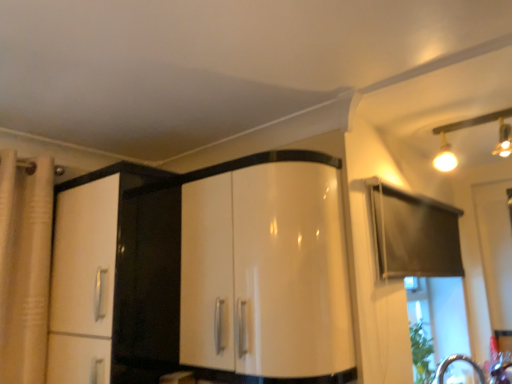
Question: Is matte gold track lights at upper right facing away from glossy white cabinet at center?

Choices:
 (A) no
 (B) yes

Answer: (A)

Question: Does matte gold track lights at upper right have a larger size compared to glossy white cabinet at center?

Choices:
 (A) no
 (B) yes

Answer: (A)

Question: From a real-world perspective, is matte gold track lights at upper right under glossy white cabinet at center?

Choices:
 (A) no
 (B) yes

Answer: (A)

Question: Does matte gold track lights at upper right touch glossy white cabinet at center?

Choices:
 (A) yes
 (B) no

Answer: (B)

Question: Is matte gold track lights at upper right smaller than glossy white cabinet at center?

Choices:
 (A) yes
 (B) no

Answer: (A)

Question: Does matte gold track lights at upper right have a lesser height compared to glossy white cabinet at center?

Choices:
 (A) no
 (B) yes

Answer: (B)

Question: Does glossy white cabinet at center have a smaller size compared to matte gold track lights at upper right?

Choices:
 (A) yes
 (B) no

Answer: (B)

Question: Is glossy white cabinet at center positioned with its back to matte gold track lights at upper right?

Choices:
 (A) no
 (B) yes

Answer: (A)

Question: Does glossy white cabinet at center have a greater width compared to matte gold track lights at upper right?

Choices:
 (A) no
 (B) yes

Answer: (A)

Question: Can you confirm if glossy white cabinet at center is taller than matte gold track lights at upper right?

Choices:
 (A) yes
 (B) no

Answer: (A)

Question: Considering the relative positions of glossy white cabinet at center and matte gold track lights at upper right in the image provided, is glossy white cabinet at center behind matte gold track lights at upper right?

Choices:
 (A) no
 (B) yes

Answer: (A)

Question: Is glossy white cabinet at center next to matte gold track lights at upper right?

Choices:
 (A) yes
 (B) no

Answer: (B)

Question: Is point (194, 274) closer or farther from the camera than point (503, 109)?

Choices:
 (A) closer
 (B) farther

Answer: (A)